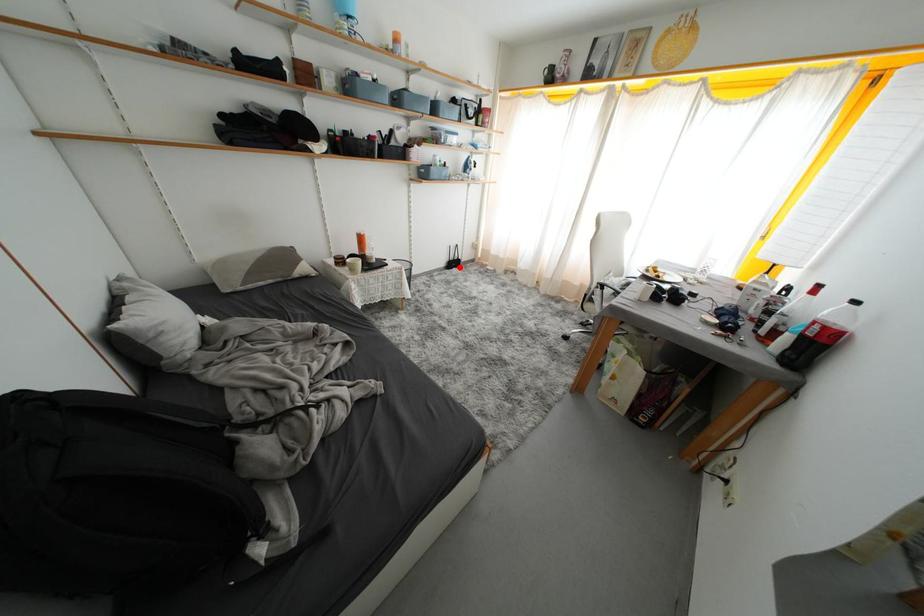
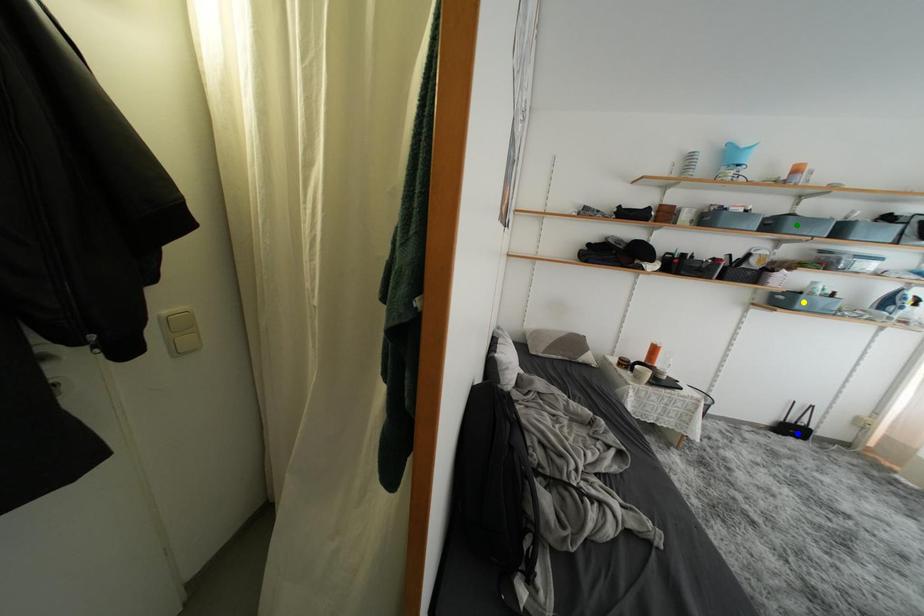
Question: I am providing you with two images of the same scene from different viewpoints. A red point is marked on the first image. You are given multiple points on the second image. Which spot in image 2 lines up with the point in image 1?

Choices:
 (A) yellow point
 (B) green point
 (C) blue point

Answer: (C)